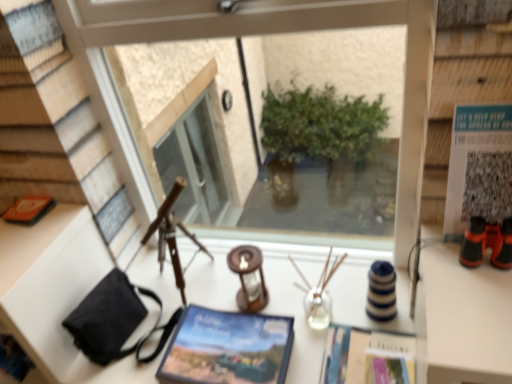
Question: Does translucent glass candle holder at center, which ranks as the 1th candle holder in right-to-left order, appear on the left side of matte paper magazine at center, the first magazine positioned from the right?

Choices:
 (A) yes
 (B) no

Answer: (A)

Question: Does translucent glass candle holder at center, which ranks as the 1th candle holder in right-to-left order, come in front of matte paper magazine at center, acting as the 2th magazine starting from the left?

Choices:
 (A) yes
 (B) no

Answer: (B)

Question: From a real-world perspective, is translucent glass candle holder at center, which ranks as the 1th candle holder in right-to-left order, positioned under matte paper magazine at center, acting as the 2th magazine starting from the left, based on gravity?

Choices:
 (A) yes
 (B) no

Answer: (B)

Question: From the image's perspective, is translucent glass candle holder at center, which ranks as the 1th candle holder in right-to-left order, below matte paper magazine at center, the first magazine positioned from the right?

Choices:
 (A) yes
 (B) no

Answer: (B)

Question: Is translucent glass candle holder at center, which ranks as the 1th candle holder in right-to-left order, turned away from matte paper magazine at center, the first magazine positioned from the right?

Choices:
 (A) yes
 (B) no

Answer: (B)

Question: Does translucent glass candle holder at center, which ranks as the 1th candle holder in right-to-left order, have a greater width compared to matte paper magazine at center, acting as the 2th magazine starting from the left?

Choices:
 (A) yes
 (B) no

Answer: (B)

Question: Does orange matte book at left appear on the left side of translucent glass candle holder at center, the second candle holder positioned from the left?

Choices:
 (A) no
 (B) yes

Answer: (B)

Question: Would you say orange matte book at left is outside translucent glass candle holder at center, the second candle holder positioned from the left?

Choices:
 (A) no
 (B) yes

Answer: (B)

Question: From a real-world perspective, is orange matte book at left physically below translucent glass candle holder at center, the second candle holder positioned from the left?

Choices:
 (A) yes
 (B) no

Answer: (B)

Question: Considering the relative sizes of orange matte book at left and translucent glass candle holder at center, the second candle holder positioned from the left, in the image provided, is orange matte book at left smaller than translucent glass candle holder at center, the second candle holder positioned from the left,?

Choices:
 (A) yes
 (B) no

Answer: (A)

Question: Does orange matte book at left have a lesser height compared to translucent glass candle holder at center, which ranks as the 1th candle holder in right-to-left order?

Choices:
 (A) yes
 (B) no

Answer: (A)

Question: Is orange matte book at left in front of translucent glass candle holder at center, which ranks as the 1th candle holder in right-to-left order?

Choices:
 (A) yes
 (B) no

Answer: (B)

Question: From a real-world perspective, is white paper at upper right physically above translucent glass candle holder at center, the second candle holder positioned from the left?

Choices:
 (A) yes
 (B) no

Answer: (A)